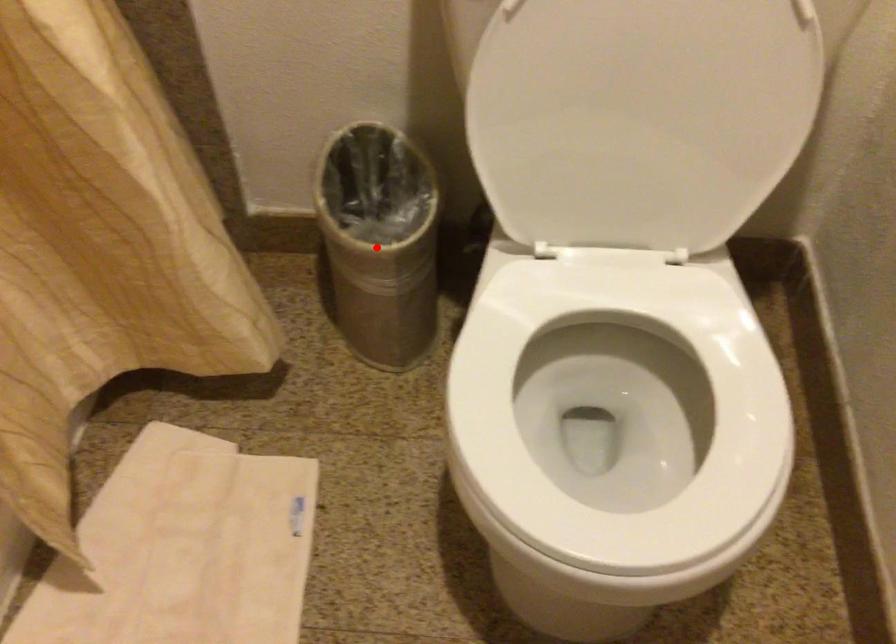
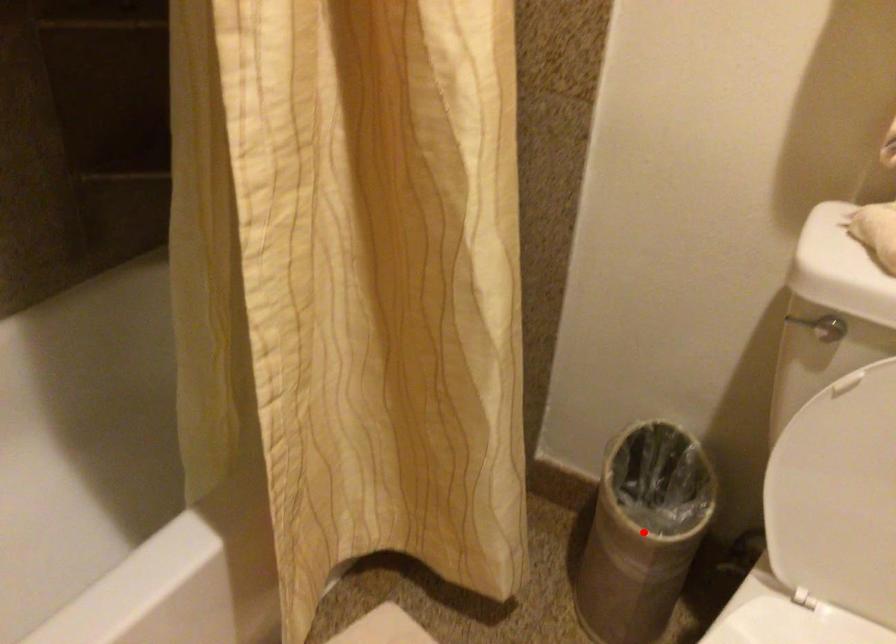
I am providing you with two images of the same scene from different viewpoints. A red point is marked on the first image and another point is marked on the second image. Is the red point in image1 aligned with the point shown in image2?

Yes